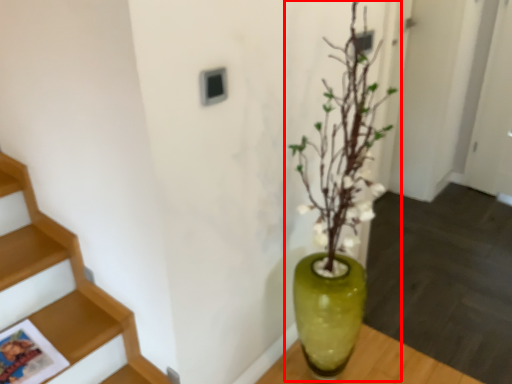
Question: From the image's perspective, where is houseplant (annotated by the red box) located in relation to vase in the image?

Choices:
 (A) below
 (B) above

Answer: (B)